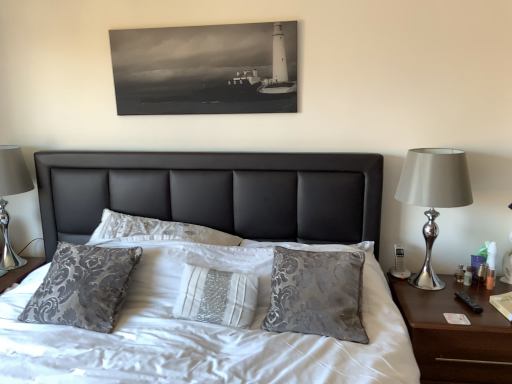
Question: Does brown wood nightstand at right have a greater height compared to silver metallic lamp at right?

Choices:
 (A) no
 (B) yes

Answer: (A)

Question: Is brown wood nightstand at right shorter than silver metallic lamp at right?

Choices:
 (A) yes
 (B) no

Answer: (A)

Question: Is brown wood nightstand at right positioned far away from silver metallic lamp at right?

Choices:
 (A) yes
 (B) no

Answer: (B)

Question: Does brown wood nightstand at right appear on the left side of silver metallic lamp at right?

Choices:
 (A) yes
 (B) no

Answer: (B)

Question: Can you confirm if brown wood nightstand at right is wider than silver metallic lamp at right?

Choices:
 (A) no
 (B) yes

Answer: (B)

Question: Is brown wood nightstand at right thinner than silver metallic lamp at right?

Choices:
 (A) no
 (B) yes

Answer: (A)

Question: Could brown wood nightstand at right be considered to be inside silver metallic lamp at right?

Choices:
 (A) no
 (B) yes

Answer: (A)

Question: Is silver metallic lamp at right positioned beyond the bounds of brown wood nightstand at right?

Choices:
 (A) yes
 (B) no

Answer: (A)

Question: Is silver metallic lamp at right bigger than brown wood nightstand at right?

Choices:
 (A) yes
 (B) no

Answer: (B)

Question: Does silver metallic lamp at right have a lesser width compared to brown wood nightstand at right?

Choices:
 (A) yes
 (B) no

Answer: (A)

Question: Is silver metallic lamp at right aimed at brown wood nightstand at right?

Choices:
 (A) no
 (B) yes

Answer: (A)

Question: Is silver metallic lamp at right at the left side of brown wood nightstand at right?

Choices:
 (A) no
 (B) yes

Answer: (B)

Question: Is brown wood nightstand at right positioned behind silver metallic table lamp at left?

Choices:
 (A) no
 (B) yes

Answer: (A)